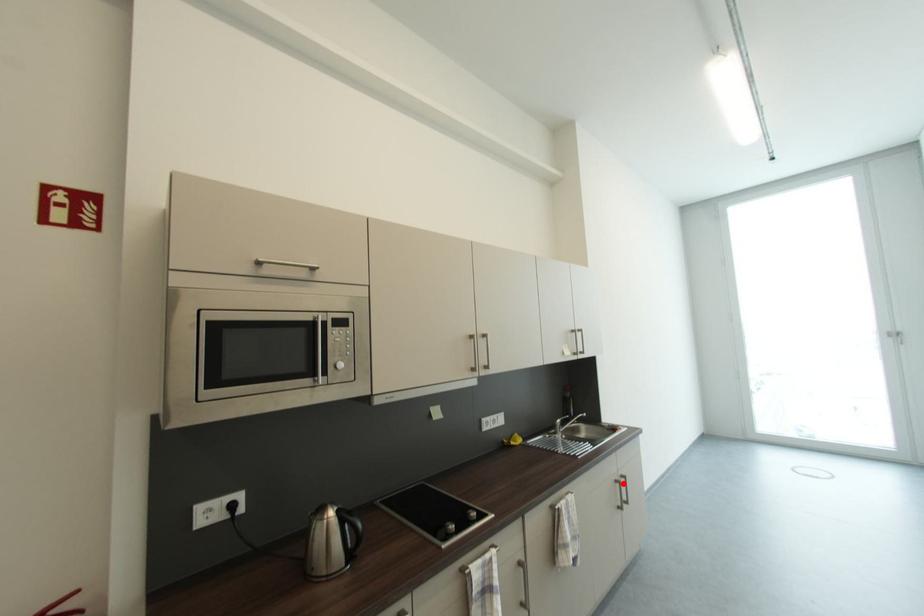
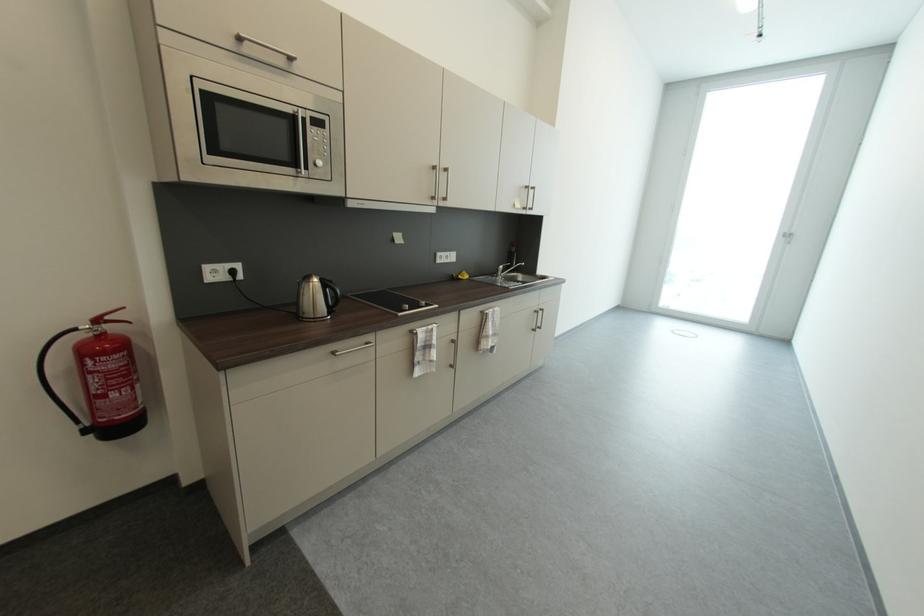
In the second image, find the point that corresponds to the highlighted location in the first image.

(541, 313)